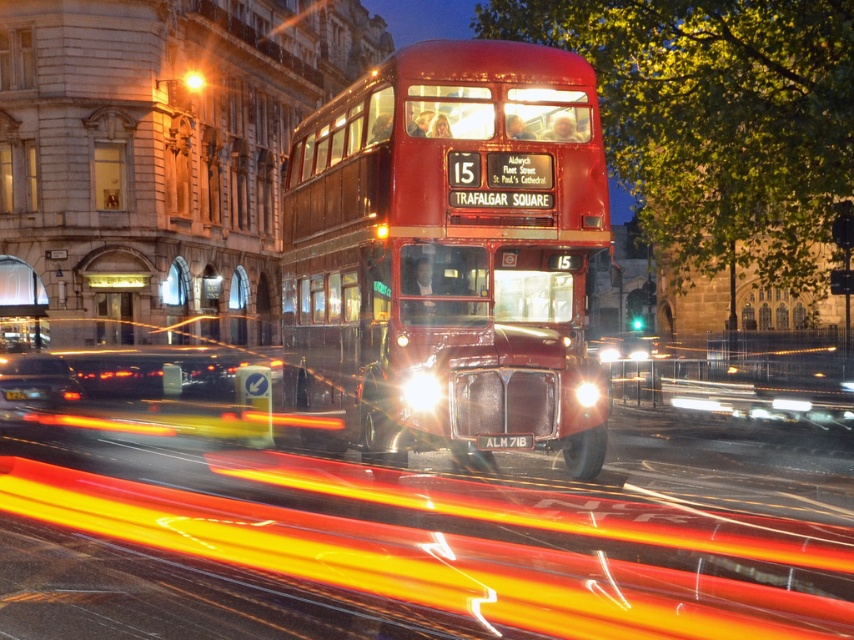
Between shiny black sedan at lower left and black plastic license plate at center, which one has more height?

With more height is shiny black sedan at lower left.

Who is shorter, shiny black sedan at lower left or black plastic license plate at center?

black plastic license plate at center is shorter.

Who is more distant from viewer, (x=71, y=400) or (x=506, y=444)?

The point (x=71, y=400) is more distant.

This screenshot has width=854, height=640. What are the coordinates of `shiny black sedan at lower left` in the screenshot? It's located at (34, 380).

Is shiny red bus at center to the right of shiny black sedan at lower left from the viewer's perspective?

Yes, shiny red bus at center is to the right of shiny black sedan at lower left.

Can you confirm if shiny red bus at center is bigger than shiny black sedan at lower left?

No, shiny red bus at center is not bigger than shiny black sedan at lower left.

Between point (463, 300) and point (50, 397), which one is positioned behind?

The point (50, 397) is more distant.

At what (x,y) coordinates should I click in order to perform the action: click on shiny red bus at center. Please return your answer as a coordinate pair (x, y). The width and height of the screenshot is (854, 640). Looking at the image, I should click on (449, 253).

Does shiny red bus at center lie behind black plastic license plate at center?

Yes, it is.

Is shiny red bus at center below black plastic license plate at center?

Yes, shiny red bus at center is below black plastic license plate at center.

Who is more distant from viewer, (496, 170) or (515, 445)?

The point (496, 170) is behind.

You are a GUI agent. You are given a task and a screenshot of the screen. Output one action in this format:
    pyautogui.click(x=<x>, y=<y>)
    Task: Click on the shiny red bus at center
    
    Given the screenshot: What is the action you would take?
    pyautogui.click(x=449, y=253)